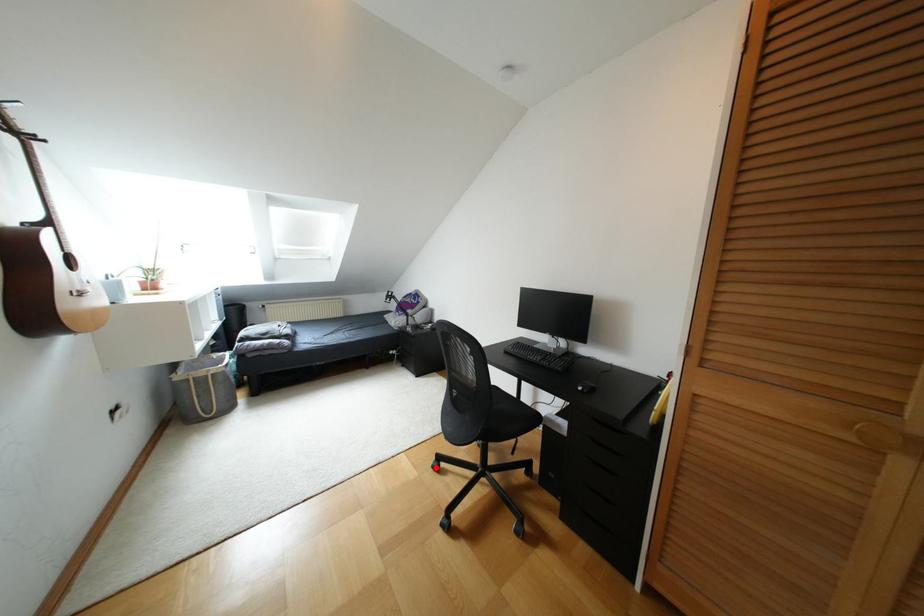
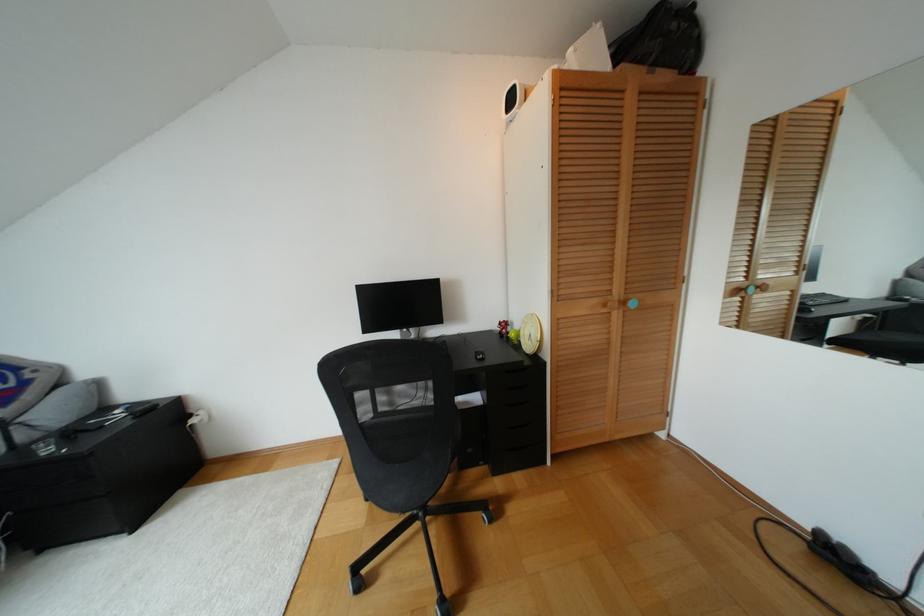
Locate, in the second image, the point that corresponds to the highlighted location in the first image.

(359, 585)